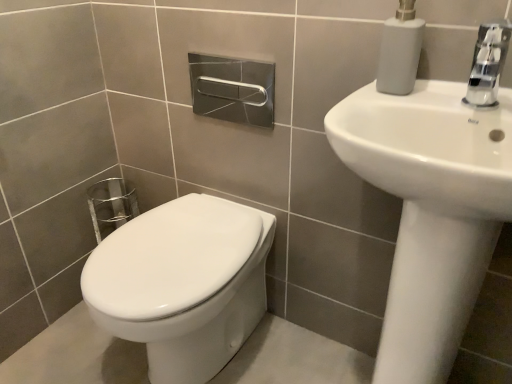
Locate an element on the screen. The image size is (512, 384). free space between white matte soap dispenser at upper right and chrome metallic faucet at upper right is located at coordinates (431, 95).